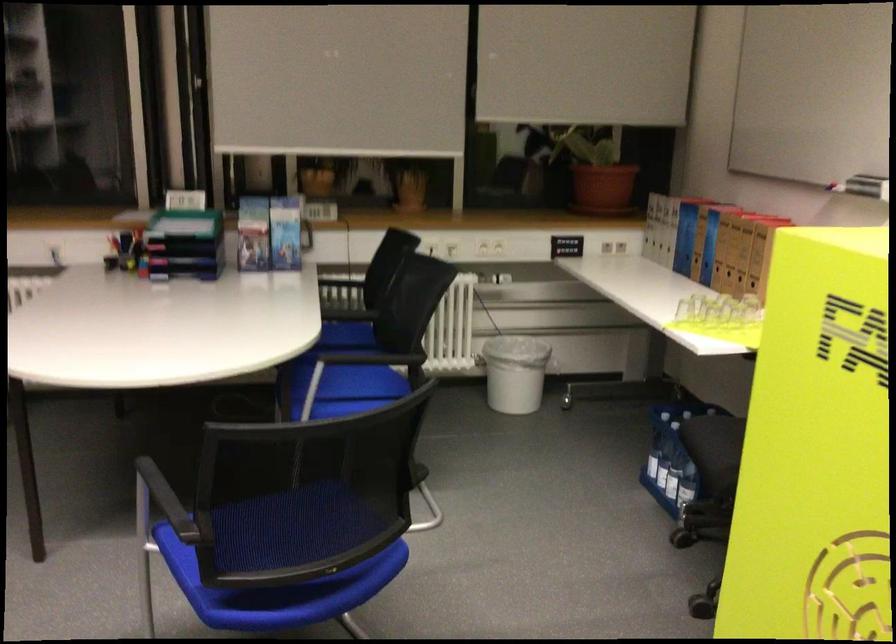
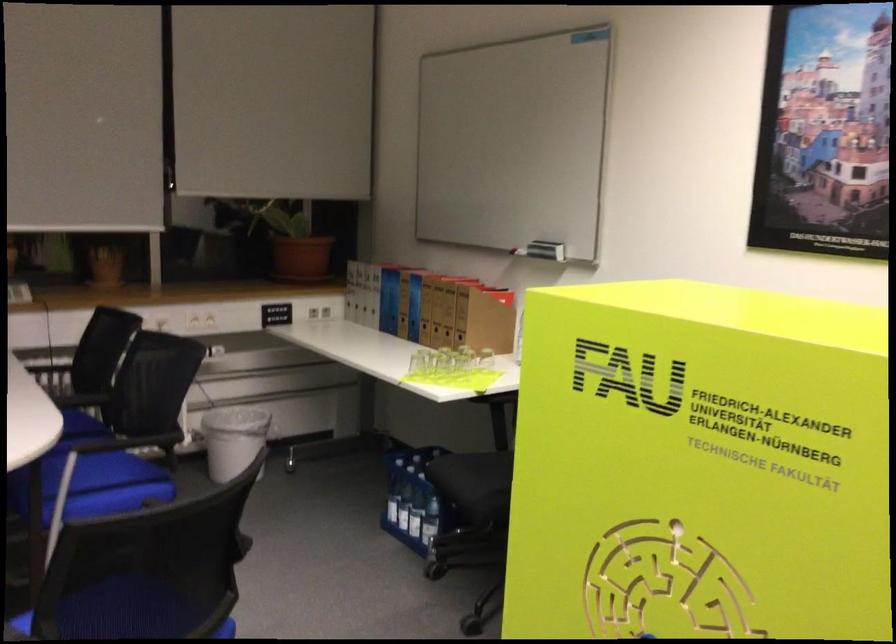
In the second image, find the point that corresponds to the point at 351,390 in the first image.

(95, 485)